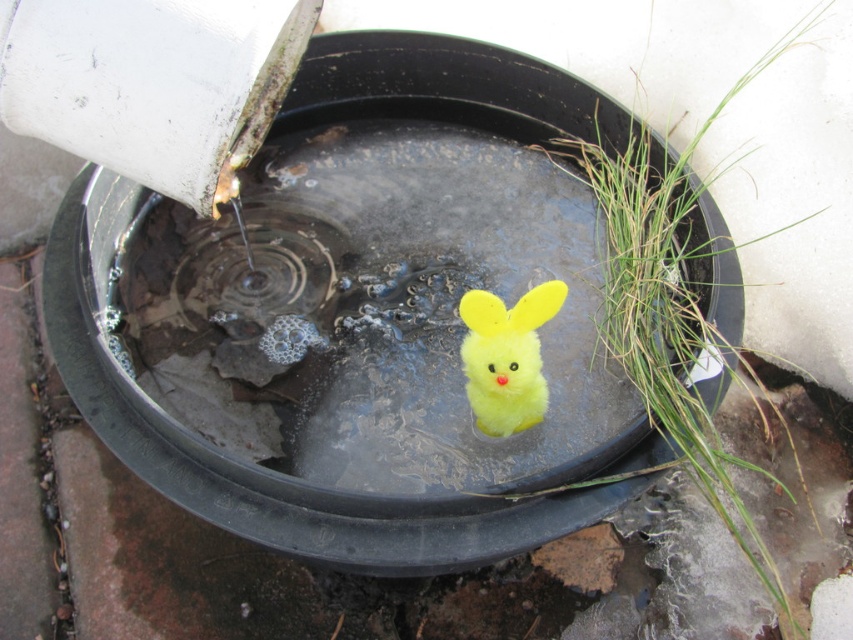
You are trying to determine which object is wider between the yellow plush toy at center and the fluffy yellow plush at center. Which one is wider?

The yellow plush toy at center is wider than the fluffy yellow plush at center according to the description.

You are standing in front of the black plastic container and want to place a small plant between the two points marked as point (448, 449) and point (509, 355). Which point should you place the plant closer to so that it appears closer to you?

You should place the plant closer to point (448, 449) because it is further to the viewer than point (509, 355), making it appear closer to you.

You are standing next to the black plastic container and see the point at coordinates [372,310]. What object is located at that point?

The point at coordinates [372,310] corresponds to the yellow plush toy at center.